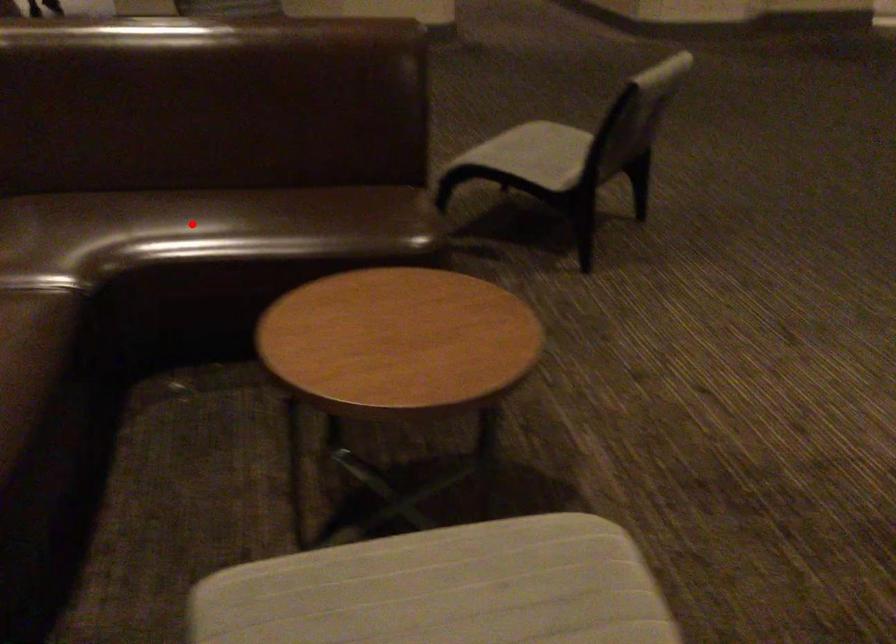
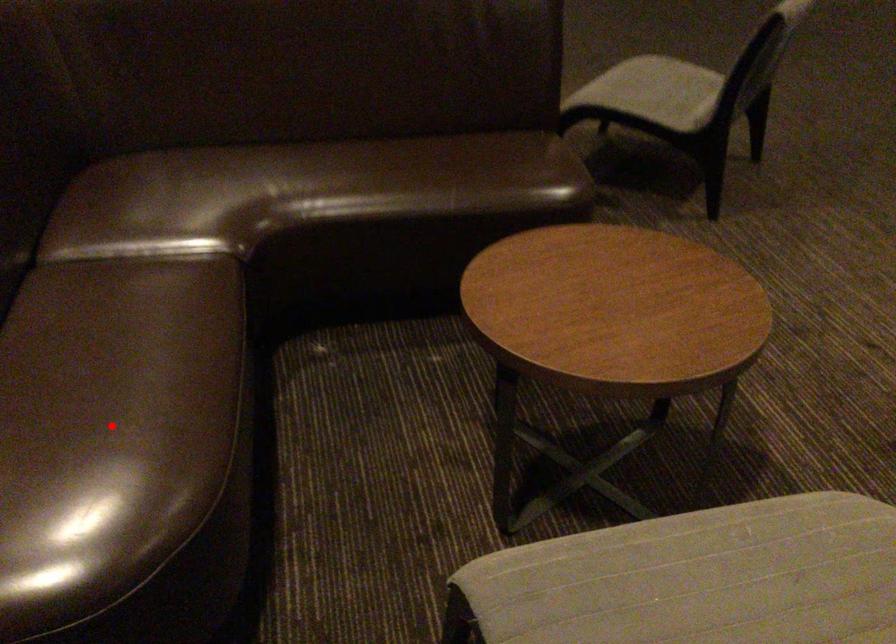
I am providing you with two images of the same scene from different viewpoints. A red point is marked on the first image and another point is marked on the second image. Do the highlighted points in image1 and image2 indicate the same real-world spot?

No